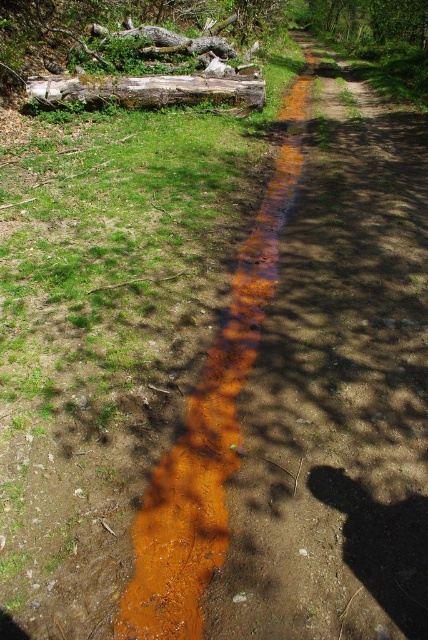
Question: Does brown mud at center have a lesser width compared to brown rough log at upper center?

Choices:
 (A) yes
 (B) no

Answer: (A)

Question: Which point is farther to the camera?

Choices:
 (A) (231, 410)
 (B) (131, 83)

Answer: (B)

Question: Which point is closer to the camera?

Choices:
 (A) tap(130, 86)
 (B) tap(269, 198)

Answer: (B)

Question: Can you confirm if brown mud at center is bigger than weathered wood log at upper left?

Choices:
 (A) no
 (B) yes

Answer: (B)

Question: Which of these objects is positioned farthest from the brown mud at center?

Choices:
 (A) brown rough log at upper center
 (B) weathered wood log at upper left

Answer: (A)

Question: Is brown mud at center wider than weathered wood log at upper left?

Choices:
 (A) yes
 (B) no

Answer: (B)